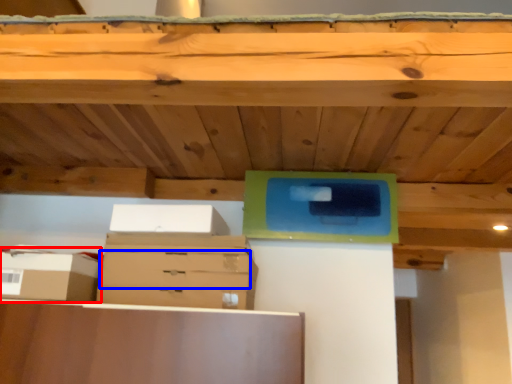
Question: Which point is further to the camera, storage box (highlighted by a red box) or drawer (highlighted by a blue box)?

Choices:
 (A) storage box
 (B) drawer

Answer: (B)